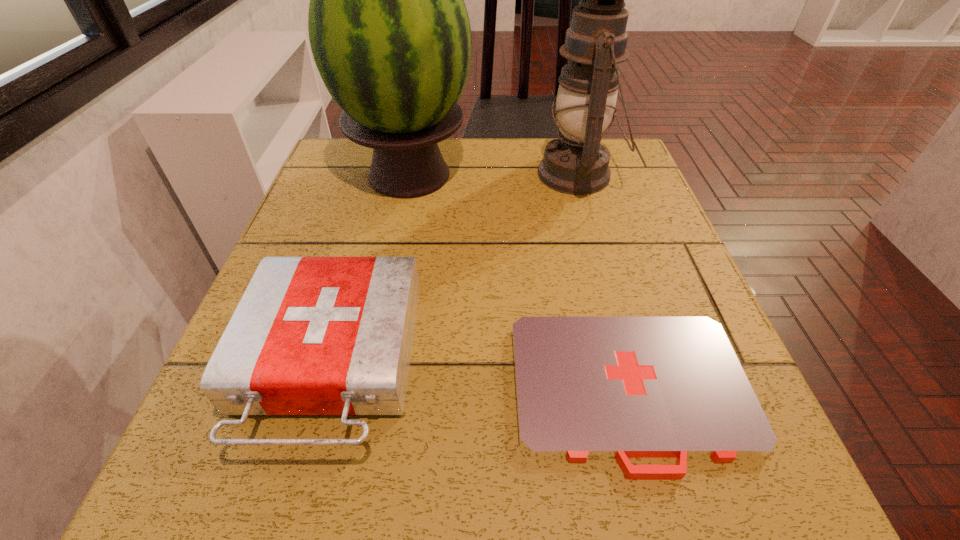
The width and height of the screenshot is (960, 540). Identify the location of vacant area at the left edge of the desktop. (258, 435).

The width and height of the screenshot is (960, 540). In the image, there is a desktop. Identify the location of vacant space at the right edge. tap(615, 204).

Identify the location of free space at the far left corner. This screenshot has height=540, width=960. (323, 173).

At what (x,y) coordinates should I click in order to perform the action: click on vacant space at the near left corner of the desktop. Please return your answer as a coordinate pair (x, y). Looking at the image, I should click on (201, 476).

The height and width of the screenshot is (540, 960). I want to click on free space that is in between the oil lamp and the taller first-aid kit, so click(x=454, y=268).

At what (x,y) coordinates should I click in order to perform the action: click on free space between the third tallest object and the right first-aid kit. Please return your answer as a coordinate pair (x, y). Looking at the image, I should click on (480, 376).

Identify the location of empty space between the watermelon and the oil lamp. (493, 175).

Identify the location of vacant space in between the watermelon and the oil lamp. (493, 175).

Where is `free space between the oil lamp and the third tallest object`? free space between the oil lamp and the third tallest object is located at coordinates (454, 268).

At what (x,y) coordinates should I click in order to perform the action: click on free space between the watermelon and the oil lamp. Please return your answer as a coordinate pair (x, y). The width and height of the screenshot is (960, 540). Looking at the image, I should click on (493, 175).